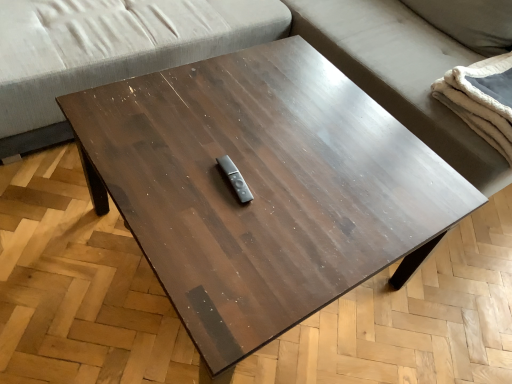
Describe the element at coordinates (247, 46) in the screenshot. The width and height of the screenshot is (512, 384). I see `gray fabric studio couch at upper center` at that location.

Describe the element at coordinates (482, 99) in the screenshot. Image resolution: width=512 pixels, height=384 pixels. I see `white fluffy blanket at right` at that location.

The width and height of the screenshot is (512, 384). What are the coordinates of `gray fabric studio couch at upper center` in the screenshot? It's located at (247, 46).

From the image's perspective, is white fluffy blanket at right located above or below gray fabric studio couch at upper center?

white fluffy blanket at right is situated lower than gray fabric studio couch at upper center in the image.

Who is taller, white fluffy blanket at right or gray fabric studio couch at upper center?

gray fabric studio couch at upper center.

Can you tell me how much white fluffy blanket at right and gray fabric studio couch at upper center differ in facing direction?

There is a 1.26-degree angle between the facing directions of white fluffy blanket at right and gray fabric studio couch at upper center.

Is white fluffy blanket at right positioned with its back to gray fabric couch at upper center?

Correct, white fluffy blanket at right is looking away from gray fabric couch at upper center.

Which is in front, point (497, 57) or point (409, 29)?

The point (497, 57) is in front.

Identify the location of blanket below the gray fabric couch at upper center (from the image's perspective). (482, 99).

Is white fluffy blanket at right bigger than gray fabric couch at upper center?

No, white fluffy blanket at right is not bigger than gray fabric couch at upper center.

Is gray fabric studio couch at upper center facing towards white fluffy blanket at right?

Yes, gray fabric studio couch at upper center is turned towards white fluffy blanket at right.

Is gray fabric studio couch at upper center located outside white fluffy blanket at right?

Absolutely, gray fabric studio couch at upper center is external to white fluffy blanket at right.

Considering the sizes of gray fabric studio couch at upper center and white fluffy blanket at right in the image, is gray fabric studio couch at upper center wider or thinner than white fluffy blanket at right?

In the image, gray fabric studio couch at upper center appears to be wider than white fluffy blanket at right.

How many degrees apart are the facing directions of gray fabric studio couch at upper center and white fluffy blanket at right?

The angle between the facing direction of gray fabric studio couch at upper center and the facing direction of white fluffy blanket at right is 1.26 degrees.

In terms of width, does gray fabric studio couch at upper center look wider or thinner when compared to gray fabric couch at upper center?

gray fabric studio couch at upper center is wider than gray fabric couch at upper center.

Is gray fabric studio couch at upper center positioned far away from gray fabric couch at upper center?

That's not correct — gray fabric studio couch at upper center is a little close to gray fabric couch at upper center.

Which is nearer, (406, 115) or (426, 139)?

Point (406, 115).

Is gray fabric studio couch at upper center spatially inside gray fabric couch at upper center, or outside of it?

gray fabric studio couch at upper center can be found inside gray fabric couch at upper center.

Is gray fabric couch at upper center taller than gray fabric studio couch at upper center?

No, gray fabric couch at upper center is not taller than gray fabric studio couch at upper center.

From the image's perspective, is gray fabric couch at upper center on top of gray fabric studio couch at upper center?

Indeed, from the image's perspective, gray fabric couch at upper center is shown above gray fabric studio couch at upper center.

The image size is (512, 384). I want to click on couch that appears on the right of gray fabric studio couch at upper center, so click(x=402, y=74).

Is gray fabric couch at upper center positioned beyond the bounds of white fluffy blanket at right?

That's correct, gray fabric couch at upper center is outside of white fluffy blanket at right.

Relative to white fluffy blanket at right, is gray fabric couch at upper center in front or behind?

Visually, gray fabric couch at upper center is located in front of white fluffy blanket at right.

In order to click on blanket on the right of the gray fabric couch at upper center in this screenshot , I will do `click(482, 99)`.

The image size is (512, 384). Identify the location of blanket lying on the right of gray fabric studio couch at upper center. (482, 99).

The image size is (512, 384). In order to click on couch lying above the white fluffy blanket at right (from the image's perspective) in this screenshot , I will do `click(402, 74)`.

When comparing their distances from white fluffy blanket at right, does gray fabric studio couch at upper center or gray fabric couch at upper center seem closer?

gray fabric couch at upper center lies closer to white fluffy blanket at right than the other object.

When comparing their distances from white fluffy blanket at right, does gray fabric couch at upper center or gray fabric studio couch at upper center seem further?

gray fabric studio couch at upper center is further to white fluffy blanket at right.

When comparing their distances from gray fabric studio couch at upper center, does gray fabric couch at upper center or white fluffy blanket at right seem closer?

Based on the image, gray fabric couch at upper center appears to be nearer to gray fabric studio couch at upper center.

Based on their spatial positions, is white fluffy blanket at right or gray fabric couch at upper center further from gray fabric studio couch at upper center?

white fluffy blanket at right is positioned further to the anchor gray fabric studio couch at upper center.

Which object lies nearer to the anchor point gray fabric couch at upper center, gray fabric studio couch at upper center or white fluffy blanket at right?

gray fabric studio couch at upper center.

Considering their positions, is white fluffy blanket at right positioned closer to gray fabric couch at upper center than gray fabric studio couch at upper center?

gray fabric studio couch at upper center is positioned closer to the anchor gray fabric couch at upper center.

I want to click on couch situated between gray fabric studio couch at upper center and white fluffy blanket at right from left to right, so click(x=402, y=74).